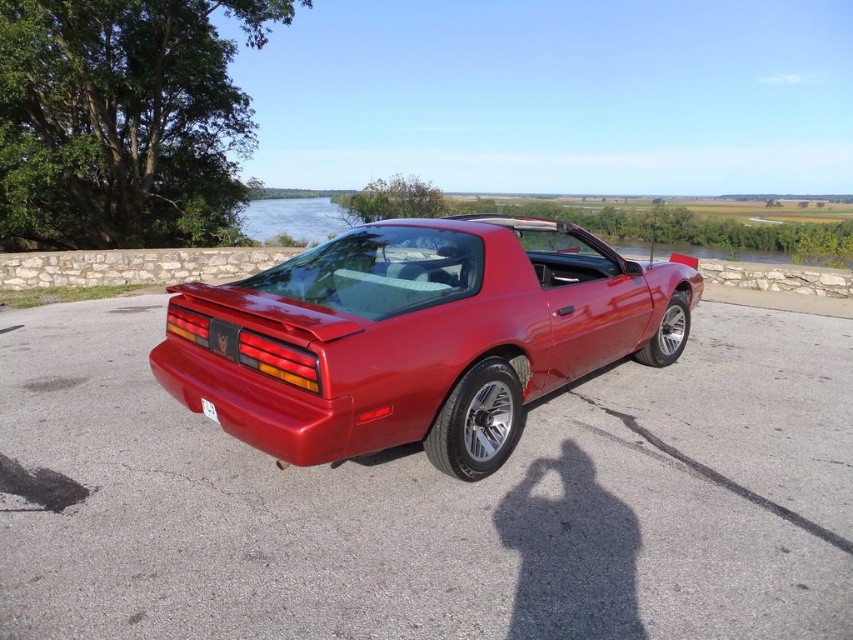
Question: Is the position of glossy metallic car at center more distant than that of white plastic license plate at lower center?

Choices:
 (A) yes
 (B) no

Answer: (B)

Question: Which object appears closest to the camera in this image?

Choices:
 (A) glossy metallic car at center
 (B) white plastic license plate at lower center

Answer: (A)

Question: Does glossy metallic car at center appear under white plastic license plate at lower center?

Choices:
 (A) yes
 (B) no

Answer: (B)

Question: Does glossy metallic car at center appear over white plastic license plate at lower center?

Choices:
 (A) yes
 (B) no

Answer: (A)

Question: Which of the following is the closest to the observer?

Choices:
 (A) glossy metallic car at center
 (B) white plastic license plate at lower center

Answer: (A)